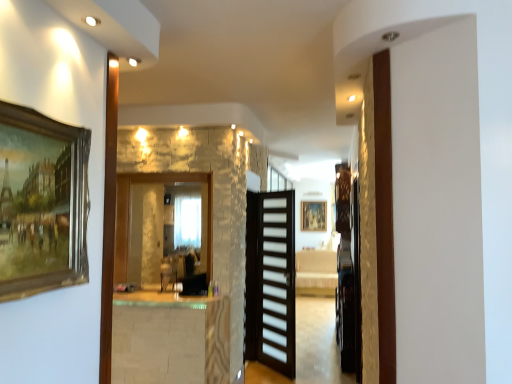
Where is `clear glass mirror at center`? This screenshot has height=384, width=512. clear glass mirror at center is located at coordinates pos(129,213).

Image resolution: width=512 pixels, height=384 pixels. Describe the element at coordinates (170, 338) in the screenshot. I see `white marble table at center` at that location.

Image resolution: width=512 pixels, height=384 pixels. What do you see at coordinates (44, 206) in the screenshot?
I see `wooden picture frame at left` at bounding box center [44, 206].

This screenshot has width=512, height=384. In order to click on black matte door at center in this screenshot , I will do `click(270, 280)`.

The height and width of the screenshot is (384, 512). I want to click on clear glass mirror at center, so click(129, 213).

From a real-world perspective, between white marble table at center and clear glass mirror at center, who is vertically lower?

From a 3D spatial view, white marble table at center is below.

Considering the positions of points (221, 358) and (183, 175), is point (221, 358) farther from camera compared to point (183, 175)?

No, it is in front of (183, 175).

Is white marble table at center next to clear glass mirror at center and touching it?

No, white marble table at center is not with clear glass mirror at center.

From a real-world perspective, is clear glass mirror at center physically located above or below white marble table at center?

From a real-world perspective, clear glass mirror at center is physically above white marble table at center.

Is clear glass mirror at center further to camera compared to white marble table at center?

Yes.

Can you confirm if clear glass mirror at center is smaller than white marble table at center?

Yes.

Between clear glass mirror at center and white marble table at center, which one appears on the left side from the viewer's perspective?

Positioned to the left is clear glass mirror at center.

Can you confirm if clear glass mirror at center is wider than wooden picture frame at left?

Indeed, clear glass mirror at center has a greater width compared to wooden picture frame at left.

Is the position of clear glass mirror at center less distant than that of wooden picture frame at left?

No, clear glass mirror at center is behind wooden picture frame at left.

From a real-world perspective, is clear glass mirror at center positioned above or below wooden picture frame at left?

In terms of real-world spatial position, clear glass mirror at center is below wooden picture frame at left.

From a real-world perspective, who is located higher, wooden picture frame at left or clear glass mirror at center?

wooden picture frame at left, from a real-world perspective.

Is wooden picture frame at left taller or shorter than clear glass mirror at center?

wooden picture frame at left is shorter than clear glass mirror at center.

Does wooden picture frame at left appear on the right side of clear glass mirror at center?

Yes, wooden picture frame at left is to the right of clear glass mirror at center.

Is black matte door at center at the right side of wooden picture frame at left?

Yes.

From the image's perspective, is black matte door at center located beneath wooden picture frame at left?

Yes, from the image's perspective, black matte door at center is beneath wooden picture frame at left.

What's the angular difference between black matte door at center and wooden picture frame at left's facing directions?

They differ by 137 degrees in their facing directions.

Is black matte door at center outside of wooden picture frame at left?

black matte door at center lies outside wooden picture frame at left's area.

Which is in front, clear glass mirror at center or black matte door at center?

clear glass mirror at center is more forward.

Considering the relative positions of clear glass mirror at center and black matte door at center in the image provided, is clear glass mirror at center to the right of black matte door at center from the viewer's perspective?

Incorrect, clear glass mirror at center is not on the right side of black matte door at center.

Is clear glass mirror at center bigger than black matte door at center?

Indeed, clear glass mirror at center has a larger size compared to black matte door at center.

From a real-world perspective, who is located higher, clear glass mirror at center or black matte door at center?

clear glass mirror at center, from a real-world perspective.

Do you think black matte door at center is within clear glass mirror at center, or outside of it?

black matte door at center exists outside the volume of clear glass mirror at center.

What's the angular difference between black matte door at center and clear glass mirror at center's facing directions?

They differ by 46.5 degrees in their facing directions.

You are a GUI agent. You are given a task and a screenshot of the screen. Output one action in this format:
    pyautogui.click(x=<x>, y=<y>)
    Task: Click on the mirror on the left side of black matte door at center
    
    Given the screenshot: What is the action you would take?
    pyautogui.click(x=129, y=213)

Is black matte door at center bigger or smaller than clear glass mirror at center?

black matte door at center is smaller than clear glass mirror at center.

Locate an element on the screen. mirror located on the left of white marble table at center is located at coordinates (129, 213).

Where is `mirror lying behind the white marble table at center`? Image resolution: width=512 pixels, height=384 pixels. mirror lying behind the white marble table at center is located at coordinates tap(129, 213).

From the image, which object appears to be nearer to black matte door at center, wooden picture frame at left or white marble table at center?

The object closer to black matte door at center is white marble table at center.

Based on their spatial positions, is white marble table at center or black matte door at center further from wooden picture frame at left?

Among the two, black matte door at center is located further to wooden picture frame at left.

From the image, which object appears to be farther from wooden picture frame at left, clear glass mirror at center or black matte door at center?

The object further to wooden picture frame at left is black matte door at center.

Estimate the real-world distances between objects in this image. Which object is further from wooden picture frame at left, clear glass mirror at center or white marble table at center?

clear glass mirror at center.

Looking at the image, which one is located closer to white marble table at center, black matte door at center or clear glass mirror at center?

Based on the image, clear glass mirror at center appears to be nearer to white marble table at center.

From the image, which object appears to be nearer to black matte door at center, wooden picture frame at left or clear glass mirror at center?

clear glass mirror at center.

Estimate the real-world distances between objects in this image. Which object is closer to white marble table at center, black matte door at center or wooden picture frame at left?

Based on the image, black matte door at center appears to be nearer to white marble table at center.

Considering their positions, is white marble table at center positioned further to wooden picture frame at left than clear glass mirror at center?

clear glass mirror at center.

Image resolution: width=512 pixels, height=384 pixels. I want to click on table positioned between wooden picture frame at left and clear glass mirror at center from near to far, so click(170, 338).

At what (x,y) coordinates should I click in order to perform the action: click on table between clear glass mirror at center and black matte door at center. Please return your answer as a coordinate pair (x, y). The width and height of the screenshot is (512, 384). Looking at the image, I should click on (170, 338).

Identify the location of table positioned between wooden picture frame at left and black matte door at center from near to far. Image resolution: width=512 pixels, height=384 pixels. (170, 338).

Locate an element on the screen. The height and width of the screenshot is (384, 512). mirror located between wooden picture frame at left and black matte door at center in the depth direction is located at coordinates (129, 213).